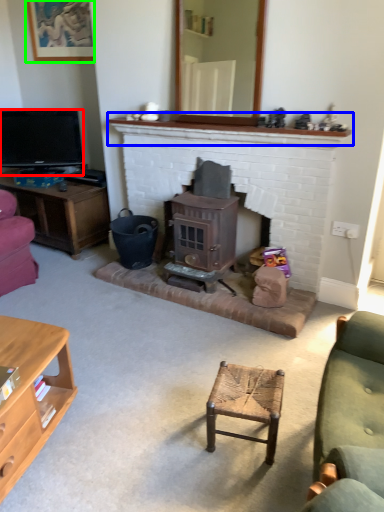
Question: Considering the real-world distances, which object is closest to television (highlighted by a red box)? mantle (highlighted by a blue box) or picture frame (highlighted by a green box).

Choices:
 (A) mantle
 (B) picture frame

Answer: (B)